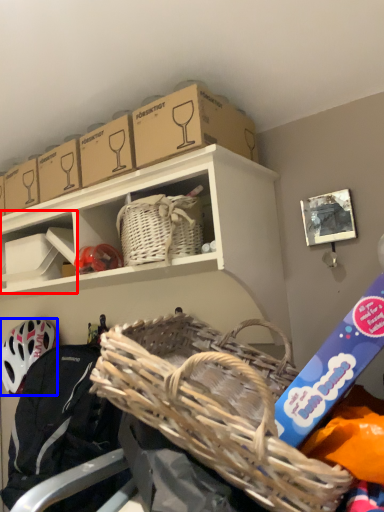
Question: Which point is closer to the camera, shelf (highlighted by a red box) or helmet (highlighted by a blue box)?

Choices:
 (A) shelf
 (B) helmet

Answer: (A)